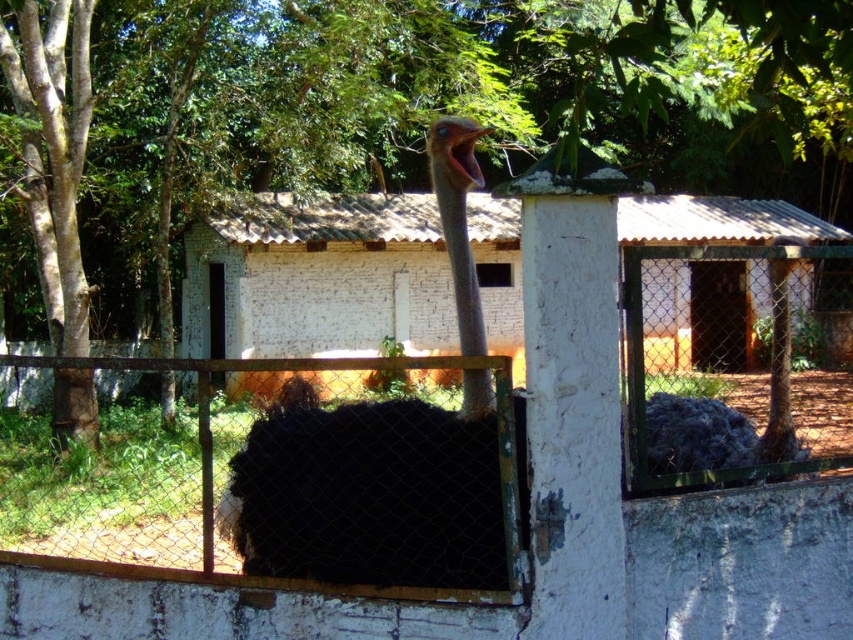
Does white brick hut at center appear on the right side of black feathered ostrich at center?

Indeed, white brick hut at center is positioned on the right side of black feathered ostrich at center.

Is point (223, 228) positioned behind point (425, 580)?

Yes, it is behind point (425, 580).

Does point (209, 269) come in front of point (354, 509)?

That is False.

The image size is (853, 640). What are the coordinates of `white brick hut at center` in the screenshot? It's located at (318, 278).

Does point (42, 108) come behind point (432, 477)?

That is True.

Who is higher up, green leafy tree at upper center or black feathered ostrich at center?

green leafy tree at upper center

Between point (817, 12) and point (491, 401), which one is positioned behind?

Point (491, 401)

This screenshot has width=853, height=640. I want to click on green leafy tree at upper center, so click(415, 92).

Does green leafy tree at upper center lie in front of white brick hut at center?

That is True.

Which is in front, point (796, 28) or point (677, 275)?

Point (796, 28)

Measure the distance between green leafy tree at upper center and camera.

The distance of green leafy tree at upper center from camera is 2.62 meters.

Locate an element on the screen. This screenshot has height=640, width=853. green leafy tree at upper center is located at coordinates (415, 92).